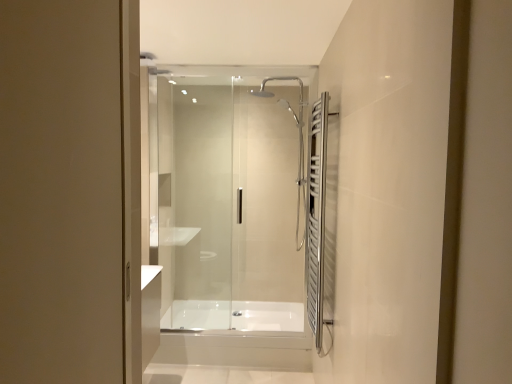
Question: Should I look upward or downward to see white glossy bathtub at center?

Choices:
 (A) up
 (B) down

Answer: (B)

Question: Is satin nickel towel rack at right to the left of transparent glass shower door at center from the viewer's perspective?

Choices:
 (A) yes
 (B) no

Answer: (B)

Question: Is satin nickel towel rack at right shorter than transparent glass shower door at center?

Choices:
 (A) yes
 (B) no

Answer: (A)

Question: From a real-world perspective, is satin nickel towel rack at right located beneath transparent glass shower door at center?

Choices:
 (A) yes
 (B) no

Answer: (A)

Question: From the image's perspective, is satin nickel towel rack at right below transparent glass shower door at center?

Choices:
 (A) no
 (B) yes

Answer: (B)

Question: Would you consider satin nickel towel rack at right to be distant from transparent glass shower door at center?

Choices:
 (A) yes
 (B) no

Answer: (B)

Question: Is satin nickel towel rack at right wider than transparent glass shower door at center?

Choices:
 (A) yes
 (B) no

Answer: (A)

Question: Is transparent glass shower door at center facing away from white glossy bathtub at center?

Choices:
 (A) yes
 (B) no

Answer: (A)

Question: From a real-world perspective, is transparent glass shower door at center under white glossy bathtub at center?

Choices:
 (A) yes
 (B) no

Answer: (B)

Question: Can you confirm if transparent glass shower door at center is shorter than white glossy bathtub at center?

Choices:
 (A) yes
 (B) no

Answer: (B)

Question: Can you confirm if transparent glass shower door at center is wider than white glossy bathtub at center?

Choices:
 (A) yes
 (B) no

Answer: (B)

Question: Is transparent glass shower door at center oriented towards white glossy bathtub at center?

Choices:
 (A) no
 (B) yes

Answer: (A)

Question: From the image's perspective, is transparent glass shower door at center below white glossy bathtub at center?

Choices:
 (A) yes
 (B) no

Answer: (B)

Question: Can we say white glossy bathtub at center lies outside transparent glass shower door at center?

Choices:
 (A) no
 (B) yes

Answer: (B)